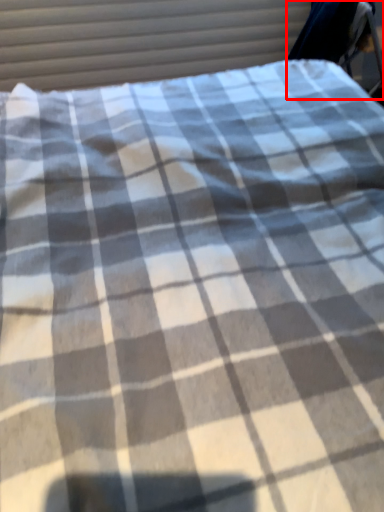
Question: From the image's perspective, considering the relative positions of swivel chair (annotated by the red box) and curtain in the image provided, where is swivel chair (annotated by the red box) located with respect to the staircase?

Choices:
 (A) above
 (B) below

Answer: (A)